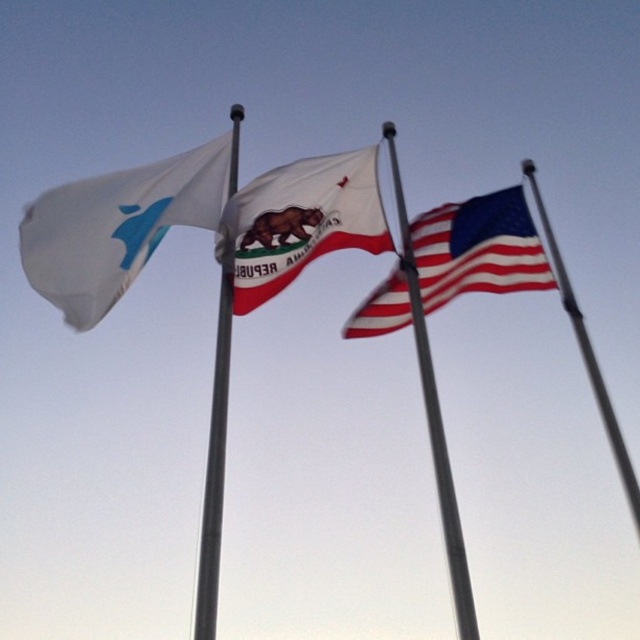
You are standing at the origin point of the coordinate system in the image. Which direction should you move to reach the silver metallic flag pole at center?

The silver metallic flag pole at center is located at coordinate point 0.727 on the x axis and 0.336 on the y axis. Since you are at the origin, you should move towards the right along the x axis and slightly upwards along the y axis to reach it.